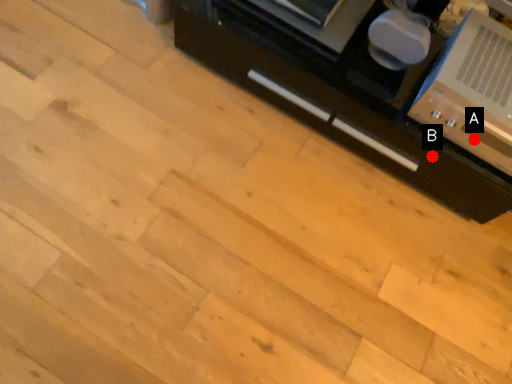
Question: Two points are circled on the image, labeled by A and B beside each circle. Among these points, which one is nearest to the camera?

Choices:
 (A) A is closer
 (B) B is closer

Answer: (A)